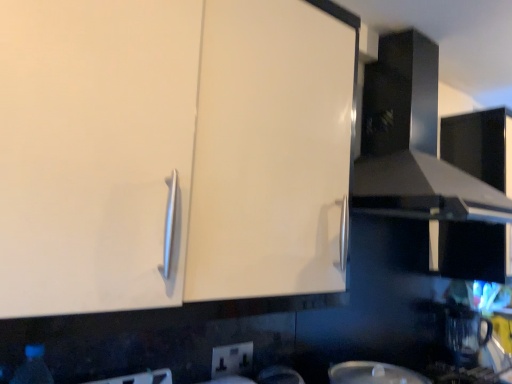
You are a GUI agent. You are given a task and a screenshot of the screen. Output one action in this format:
    pyautogui.click(x=<x>, y=<y>)
    Task: Click on the free spot above glossy black exhaust hood at upper right (from a real-world perspective)
    The height and width of the screenshot is (384, 512).
    Given the screenshot: What is the action you would take?
    pyautogui.click(x=438, y=24)